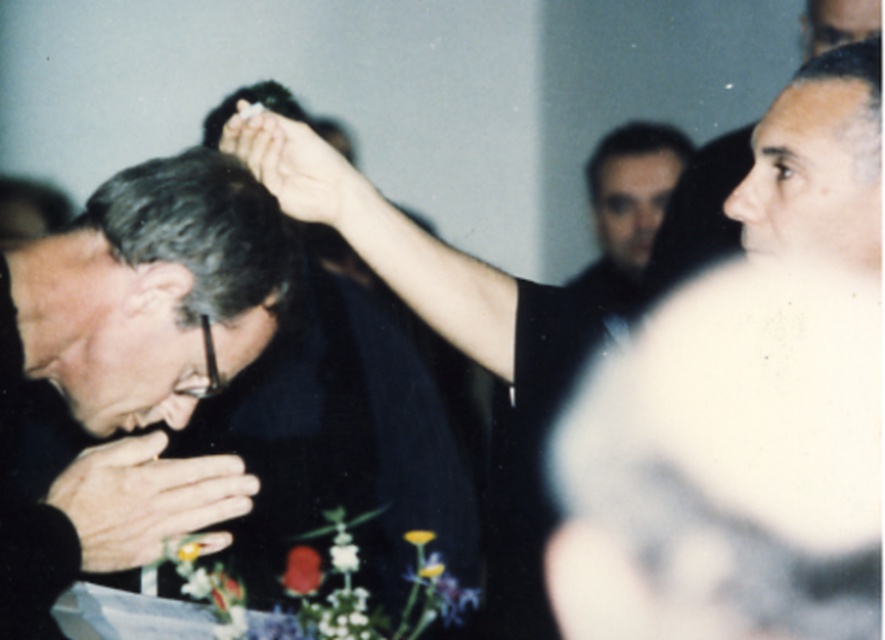
Question: Estimate the real-world distances between objects in this image. Which object is farther from the white matte flower at center?

Choices:
 (A) gray matte hair at center
 (B) smooth black hair at center
 (C) smooth dark hair at upper right

Answer: (B)

Question: Is smooth skin hand at center to the left of smooth dark hair at upper right from the viewer's perspective?

Choices:
 (A) yes
 (B) no

Answer: (A)

Question: Which point is closer to the camera taking this photo?

Choices:
 (A) [x=583, y=528]
 (B) [x=197, y=547]
 (C) [x=422, y=540]

Answer: (B)

Question: Which object is positioned closest to the white matte flowers at lower center?

Choices:
 (A) smooth black hair at center
 (B) white matte flower at center
 (C) smooth dark hair at upper right

Answer: (B)

Question: Is smooth skin face at upper right to the right of gray matte hair at upper right from the viewer's perspective?

Choices:
 (A) yes
 (B) no

Answer: (B)

Question: Can you confirm if smooth dark hair at upper right is wider than yellow matte flower at center?

Choices:
 (A) yes
 (B) no

Answer: (A)